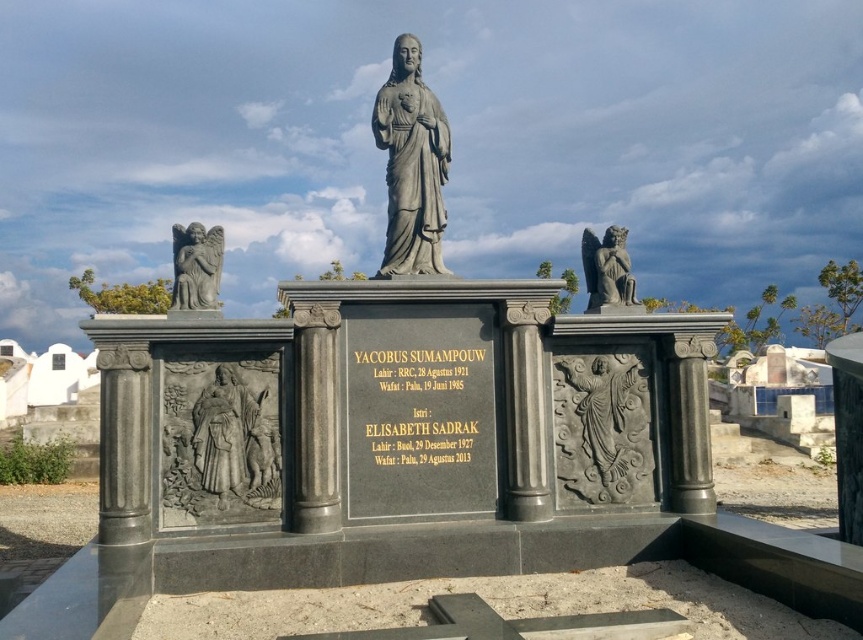
What is the exact position of the matte gray statue at lower left on the image coordinate system?

The matte gray statue at lower left is located at point coordinates (230, 436).

In the scene shown: Based on the scene described, where is the gray stone angel at right in relation to the matte gray statue at lower left?

The gray stone angel at right is located below the matte gray statue at lower left.

You are standing in front of the tombstone monument and want to place a bouquet of flowers between the gray stone angel at right and the matte gray statue at lower left. Based on their positions, where should you place the bouquet?

The gray stone angel at right is to the right of the matte gray statue at lower left, so you should place the bouquet between them by positioning it to the right of the matte gray statue at lower left and to the left of the gray stone angel at right.